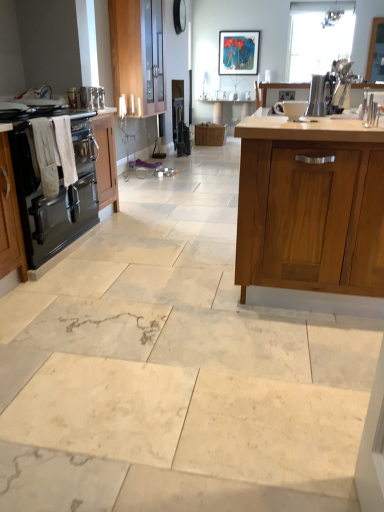
Question: Does satin silver toaster at upper right, which ranks as the second appliance in right-to-left order, have a greater width compared to matte plastic picture frame at upper center?

Choices:
 (A) no
 (B) yes

Answer: (B)

Question: Is satin silver toaster at upper right, which ranks as the second appliance in right-to-left order, surrounding matte plastic picture frame at upper center?

Choices:
 (A) no
 (B) yes

Answer: (A)

Question: From a real-world perspective, is satin silver toaster at upper right, the 3th appliance from the left, located beneath matte plastic picture frame at upper center?

Choices:
 (A) yes
 (B) no

Answer: (A)

Question: Is satin silver toaster at upper right, the 3th appliance when ordered from back to front, facing towards matte plastic picture frame at upper center?

Choices:
 (A) yes
 (B) no

Answer: (B)

Question: Is satin silver toaster at upper right, the 3th appliance when ordered from back to front, smaller than matte plastic picture frame at upper center?

Choices:
 (A) yes
 (B) no

Answer: (A)

Question: From a real-world perspective, is satin silver toaster at upper right, which ranks as the second appliance in right-to-left order, on top of matte plastic picture frame at upper center?

Choices:
 (A) no
 (B) yes

Answer: (A)

Question: Can you confirm if white cotton towel at left is wider than satin silver toaster at upper right, which ranks as the second appliance in right-to-left order?

Choices:
 (A) no
 (B) yes

Answer: (A)

Question: Considering the relative sizes of white cotton towel at left and satin silver toaster at upper right, the 3th appliance when ordered from back to front, in the image provided, is white cotton towel at left taller than satin silver toaster at upper right, the 3th appliance when ordered from back to front,?

Choices:
 (A) no
 (B) yes

Answer: (B)

Question: Does white cotton towel at left have a larger size compared to satin silver toaster at upper right, which ranks as the second appliance in right-to-left order?

Choices:
 (A) no
 (B) yes

Answer: (B)

Question: Is white cotton towel at left further to the viewer compared to satin silver toaster at upper right, the 2th appliance in the front-to-back sequence?

Choices:
 (A) yes
 (B) no

Answer: (B)

Question: Is white cotton towel at left facing towards satin silver toaster at upper right, the 3th appliance from the left?

Choices:
 (A) no
 (B) yes

Answer: (A)

Question: Considering the relative positions of white cotton towel at left and satin silver toaster at upper right, the 3th appliance from the left, in the image provided, is white cotton towel at left to the right of satin silver toaster at upper right, the 3th appliance from the left, from the viewer's perspective?

Choices:
 (A) no
 (B) yes

Answer: (A)

Question: Does satin silver toaster at center, the 1th appliance viewed from the back, contain white glossy bowl at upper center, the 1th appliance in the front-to-back sequence?

Choices:
 (A) yes
 (B) no

Answer: (B)